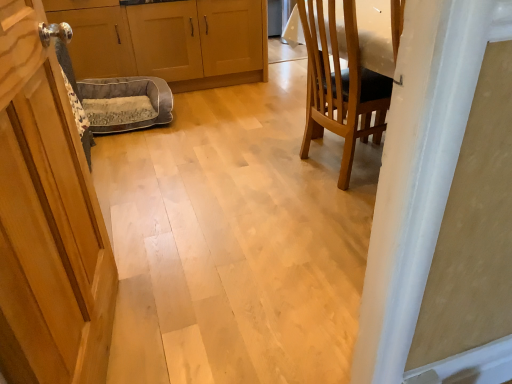
I want to click on vacant area that lies between wooden chair at right and gray fabric dog bed at center, so click(x=218, y=140).